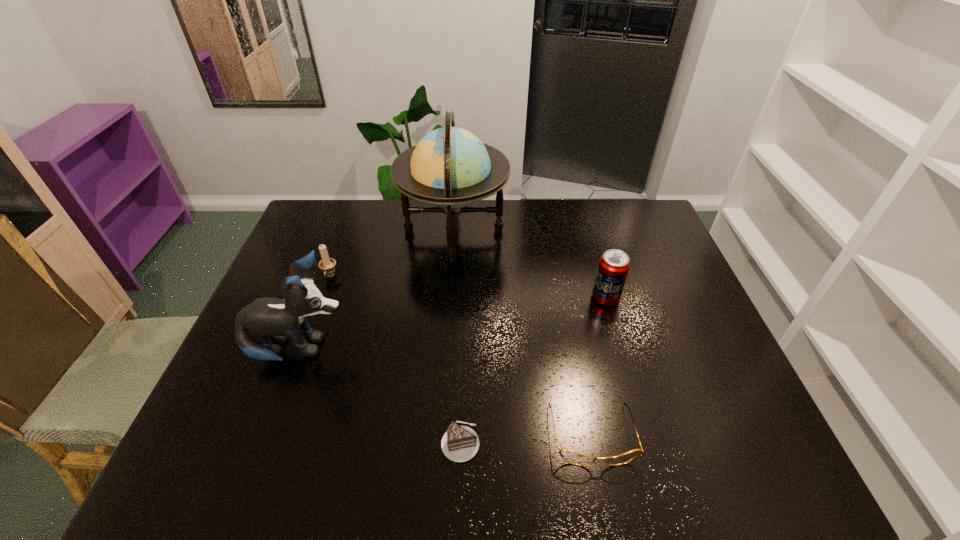
Where is `globe`? Image resolution: width=960 pixels, height=540 pixels. globe is located at coordinates (450, 168).

Find the location of a particular element. The image size is (960, 540). the tallest object is located at coordinates (450, 168).

In order to click on the fourth farthest object in this screenshot , I will do `click(279, 319)`.

Identify the location of the fifth shortest object. (279, 319).

At what (x,y) coordinates should I click in order to perform the action: click on soda can. Please return your answer as a coordinate pair (x, y). Looking at the image, I should click on (613, 268).

Identify the location of the fourth shortest object. (613, 268).

The height and width of the screenshot is (540, 960). What are the coordinates of `candle_holder` in the screenshot? It's located at (327, 264).

Find the location of a particular element. Image resolution: width=960 pixels, height=540 pixels. the second farthest object is located at coordinates (327, 264).

Locate an element on the screen. This screenshot has height=540, width=960. spectacles is located at coordinates (570, 456).

You are a GUI agent. You are given a task and a screenshot of the screen. Output one action in this format:
    pyautogui.click(x=<x>, y=<y>)
    Task: Click on the chocolate cake
    
    Given the screenshot: What is the action you would take?
    tap(460, 443)